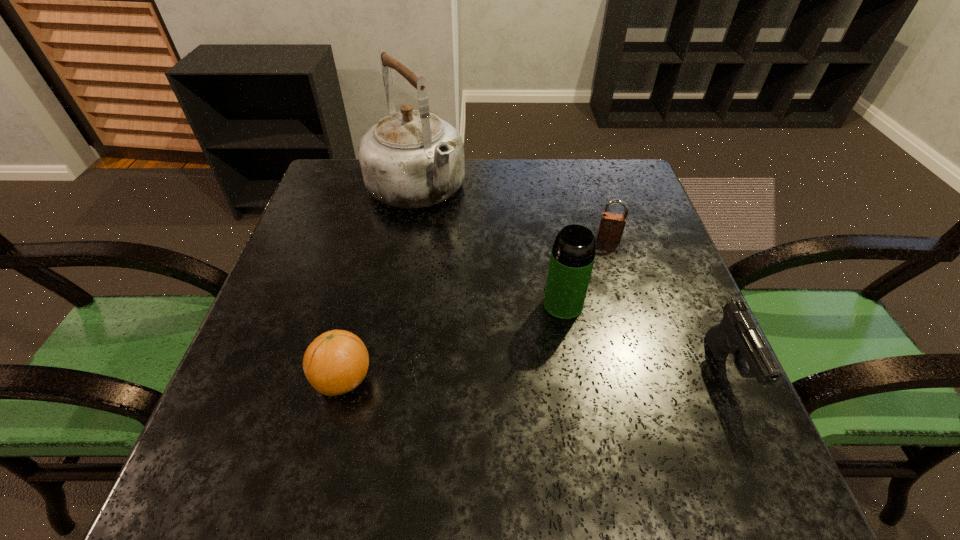
This screenshot has height=540, width=960. In the image, there is a desktop. Identify the location of vacant space at the left edge. (305, 289).

This screenshot has height=540, width=960. What are the coordinates of `free space at the far right corner of the desktop` in the screenshot? It's located at (x=583, y=163).

Identify the location of free space between the orange and the third object from right to left. (453, 342).

At what (x,y) coordinates should I click in order to perform the action: click on unoccupied area between the third object from left to right and the orange. Please return your answer as a coordinate pair (x, y). This screenshot has height=540, width=960. Looking at the image, I should click on (453, 342).

The height and width of the screenshot is (540, 960). I want to click on vacant region between the padlock and the orange, so click(x=476, y=308).

Locate an element on the screen. The image size is (960, 540). free spot between the orange and the padlock is located at coordinates (476, 308).

Locate an element on the screen. empty location between the orange and the rightmost object is located at coordinates (535, 375).

At what (x,y) coordinates should I click in order to perform the action: click on free spot between the orange and the padlock. Please return your answer as a coordinate pair (x, y). The image size is (960, 540). Looking at the image, I should click on (476, 308).

Locate an element on the screen. This screenshot has width=960, height=540. free spot between the padlock and the orange is located at coordinates click(x=476, y=308).

Where is `vacant space that is in between the second tallest object and the rightmost object`? The width and height of the screenshot is (960, 540). vacant space that is in between the second tallest object and the rightmost object is located at coordinates (645, 337).